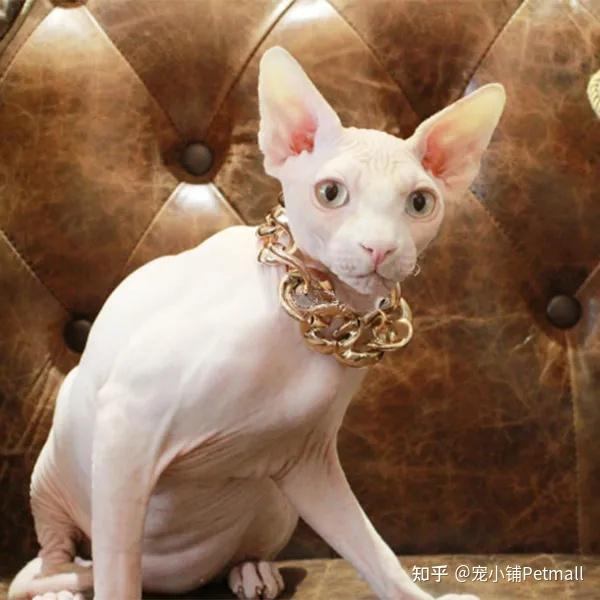
The height and width of the screenshot is (600, 600). I want to click on 3 chair buttons, so pyautogui.click(x=558, y=316), pyautogui.click(x=80, y=339), pyautogui.click(x=193, y=158).